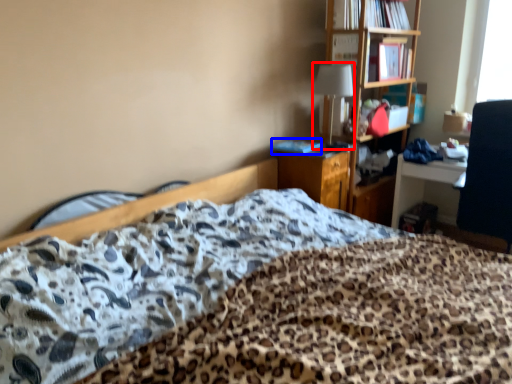
Question: Which of the following is the closest to the observer, table lamp (highlighted by a red box) or book (highlighted by a blue box)?

Choices:
 (A) table lamp
 (B) book

Answer: (A)